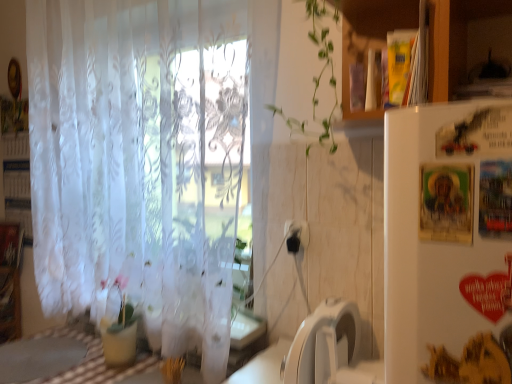
What do you see at coordinates (296, 235) in the screenshot? This screenshot has width=512, height=384. I see `black plastic electric outlet at center` at bounding box center [296, 235].

What do you see at coordinates (17, 182) in the screenshot? The height and width of the screenshot is (384, 512). I see `white cardboard bookshelf at left` at bounding box center [17, 182].

This screenshot has height=384, width=512. What are the coordinates of `white plastic washing machine at lower center` in the screenshot? It's located at (329, 348).

Find the location of a particular element. This screenshot has width=512, height=384. translucent white curtain at left is located at coordinates (146, 156).

Does translucent white curtain at left have a lesser width compared to white plastic washing machine at lower center?

Indeed, translucent white curtain at left has a lesser width compared to white plastic washing machine at lower center.

In the scene shown: From the image's perspective, is translucent white curtain at left above white plastic washing machine at lower center?

Yes, from the image's perspective, translucent white curtain at left is over white plastic washing machine at lower center.

From a real-world perspective, relative to white plastic washing machine at lower center, is translucent white curtain at left vertically above or below?

translucent white curtain at left is above white plastic washing machine at lower center.

Where is `curtain lying above the white cardboard bookshelf at left (from the image's perspective)`? curtain lying above the white cardboard bookshelf at left (from the image's perspective) is located at coordinates (146, 156).

From the image's perspective, is translucent white curtain at left under white cardboard bookshelf at left?

No.

Between translucent white curtain at left and white cardboard bookshelf at left, which one is positioned in front?

translucent white curtain at left is in front.

Is translucent white curtain at left oriented away from white cardboard bookshelf at left?

That's not correct — translucent white curtain at left is not looking away from white cardboard bookshelf at left.

Is black plastic electric outlet at center completely or partially inside white cardboard bookshelf at left?

No, black plastic electric outlet at center is located outside of white cardboard bookshelf at left.

From a real-world perspective, which object rests below the other?

black plastic electric outlet at center, from a real-world perspective.

In terms of width, does white cardboard bookshelf at left look wider or thinner when compared to black plastic electric outlet at center?

Considering their sizes, white cardboard bookshelf at left looks broader than black plastic electric outlet at center.

Is translucent white curtain at left facing towards checkered fabric table at lower left?

Yes, translucent white curtain at left faces towards checkered fabric table at lower left.

Looking at this image, can you confirm if translucent white curtain at left is thinner than checkered fabric table at lower left?

Yes.

From a real-world perspective, is translucent white curtain at left physically above checkered fabric table at lower left?

Correct, in the physical world, translucent white curtain at left is higher than checkered fabric table at lower left.

Can you confirm if white plastic washing machine at lower center is bigger than translucent white curtain at left?

No.

In the scene shown: Which is nearer, [345,346] or [55,35]?

Point [345,346] is positioned closer to the camera compared to point [55,35].

In the scene shown: Could you tell me if white plastic washing machine at lower center is turned towards translucent white curtain at left?

No, white plastic washing machine at lower center is not aimed at translucent white curtain at left.

Which object is thinner, white plastic washing machine at lower center or translucent white curtain at left?

translucent white curtain at left is thinner.

Which is more to the right, white cardboard bookshelf at left or checkered fabric table at lower left?

Positioned to the right is checkered fabric table at lower left.

From the image's perspective, between white cardboard bookshelf at left and checkered fabric table at lower left, which one is located above?

From the image's view, white cardboard bookshelf at left is above.

Is white cardboard bookshelf at left shorter than checkered fabric table at lower left?

No.

Where is `table on the right of white cardboard bookshelf at left`? table on the right of white cardboard bookshelf at left is located at coordinates (64, 360).

Is white plastic washing machine at lower center outside of black plastic electric outlet at center?

Yes, white plastic washing machine at lower center is located beyond the bounds of black plastic electric outlet at center.

Is white plastic washing machine at lower center to the left or to the right of black plastic electric outlet at center in the image?

In the image, white plastic washing machine at lower center appears on the right side of black plastic electric outlet at center.

From the image's perspective, is white plastic washing machine at lower center over black plastic electric outlet at center?

No, from the image's perspective, white plastic washing machine at lower center is not over black plastic electric outlet at center.

The height and width of the screenshot is (384, 512). There is a white plastic washing machine at lower center. In order to click on curtain above it (from a real-world perspective) in this screenshot , I will do `click(146, 156)`.

Identify the location of bookshelf below the translucent white curtain at left (from a real-world perspective). The height and width of the screenshot is (384, 512). (17, 182).

Based on their spatial positions, is black plastic electric outlet at center or translucent white curtain at left closer to white cardboard bookshelf at left?

translucent white curtain at left.

Considering their positions, is translucent white curtain at left positioned closer to black plastic electric outlet at center than white plastic washing machine at lower center?

Among the two, white plastic washing machine at lower center is located nearer to black plastic electric outlet at center.

Based on the photo, when comparing their distances from white plastic washing machine at lower center, does black plastic electric outlet at center or checkered fabric table at lower left seem further?

checkered fabric table at lower left lies further to white plastic washing machine at lower center than the other object.

Estimate the real-world distances between objects in this image. Which object is closer to white plastic washing machine at lower center, white cardboard bookshelf at left or translucent white curtain at left?

Among the two, translucent white curtain at left is located nearer to white plastic washing machine at lower center.

Looking at the image, which one is located further to black plastic electric outlet at center, translucent white curtain at left or checkered fabric table at lower left?

checkered fabric table at lower left is positioned further to the anchor black plastic electric outlet at center.

From the image, which object appears to be nearer to white cardboard bookshelf at left, translucent white curtain at left or black plastic electric outlet at center?

Based on the image, translucent white curtain at left appears to be nearer to white cardboard bookshelf at left.

Estimate the real-world distances between objects in this image. Which object is further from black plastic electric outlet at center, white plastic washing machine at lower center or translucent white curtain at left?

Based on the image, translucent white curtain at left appears to be further to black plastic electric outlet at center.

Considering their positions, is checkered fabric table at lower left positioned further to white plastic washing machine at lower center than white cardboard bookshelf at left?

white cardboard bookshelf at left.

Identify the location of curtain located between white cardboard bookshelf at left and black plastic electric outlet at center in the left-right direction. The image size is (512, 384). (146, 156).

Find the location of `curtain between white cardboard bookshelf at left and white plastic washing machine at lower center from left to right`. curtain between white cardboard bookshelf at left and white plastic washing machine at lower center from left to right is located at coordinates (146, 156).

I want to click on curtain between checkered fabric table at lower left and black plastic electric outlet at center, so click(x=146, y=156).

Identify the location of table located between white cardboard bookshelf at left and black plastic electric outlet at center in the left-right direction. The height and width of the screenshot is (384, 512). (64, 360).